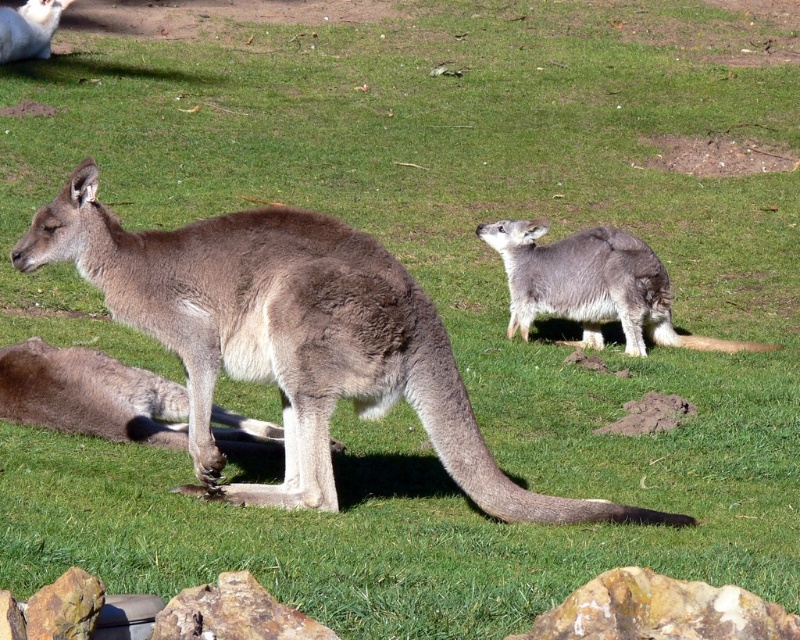
Does point (592, 634) lie behind point (36, 35)?

No, (592, 634) is closer to viewer.

Which is below, rusty rock at lower center or brown fur kangaroo at upper left?

rusty rock at lower center is below.

Identify the location of rusty rock at lower center. The height and width of the screenshot is (640, 800). (660, 611).

The image size is (800, 640). Find the location of `rusty rock at lower center`. rusty rock at lower center is located at coordinates (660, 611).

Does gray fur kangaroo at center lie in front of gray furry kangaroo at center?

That is True.

Does point (300, 397) lie in front of point (630, 323)?

That is True.

Is point (165, 342) in front of point (633, 355)?

That is True.

At what (x,y) coordinates should I click in order to perform the action: click on gray fur kangaroo at center. Please return your answer as a coordinate pair (x, y). Looking at the image, I should click on (292, 340).

Does gray furry kangaroo at center come in front of brown fur kangaroo at upper left?

Yes.

Which is below, gray furry kangaroo at center or brown fur kangaroo at upper left?

Positioned lower is gray furry kangaroo at center.

Describe the element at coordinates (592, 285) in the screenshot. I see `gray furry kangaroo at center` at that location.

Find the location of a particular element. This screenshot has width=800, height=640. gray furry kangaroo at center is located at coordinates (592, 285).